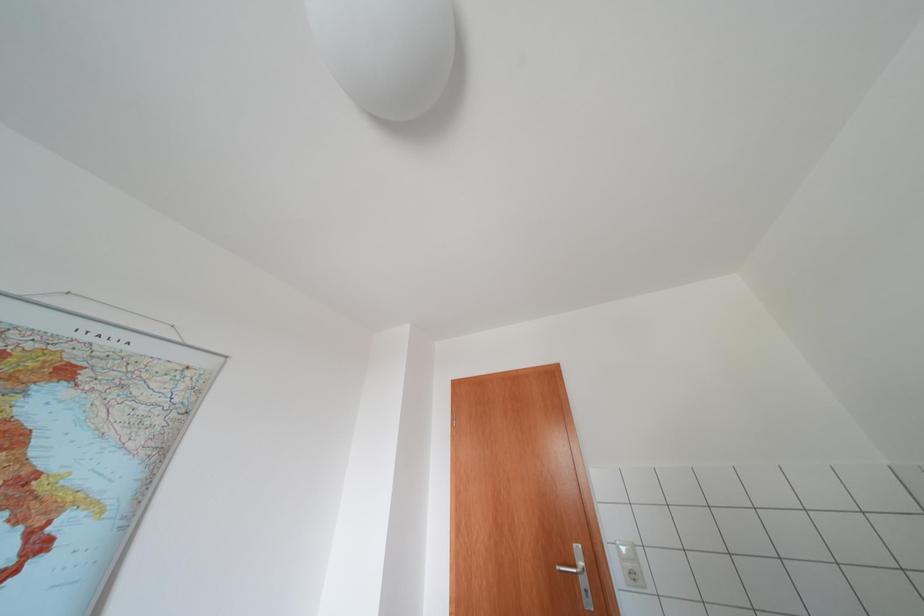
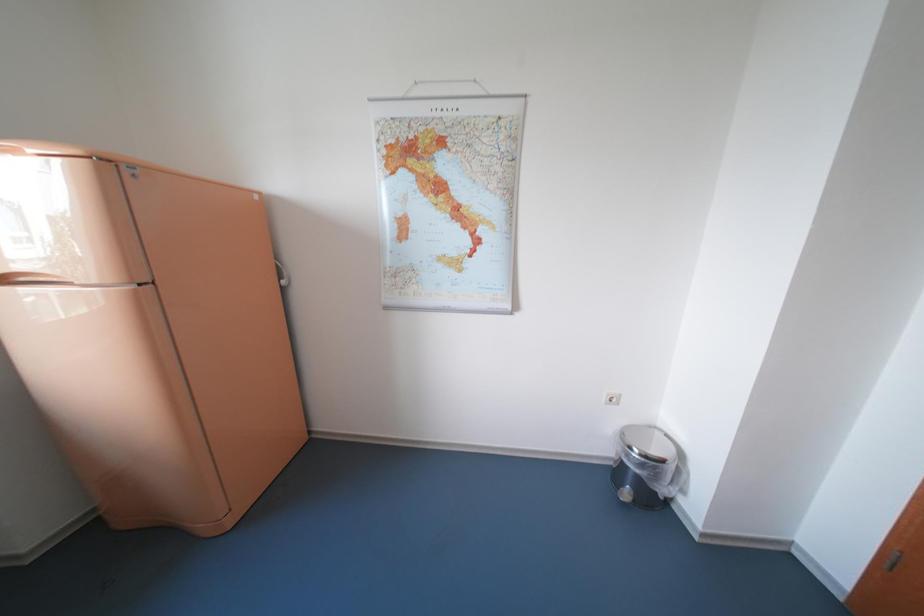
Based on the continuous images, in which direction is the camera rotating?

The rotation direction of the camera is left-down.